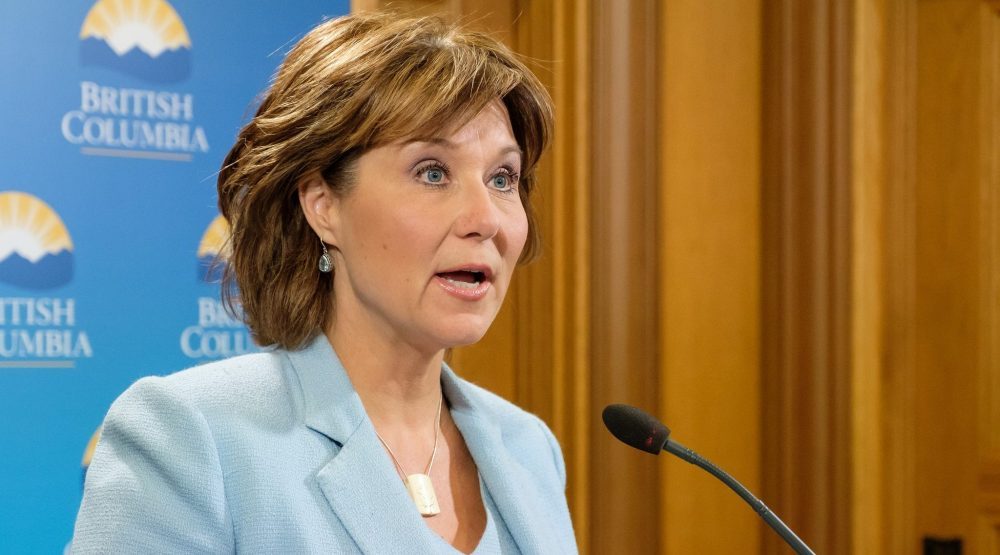
Find the location of a particular element. The width and height of the screenshot is (1000, 555). 1 pendant is located at coordinates (434, 493).